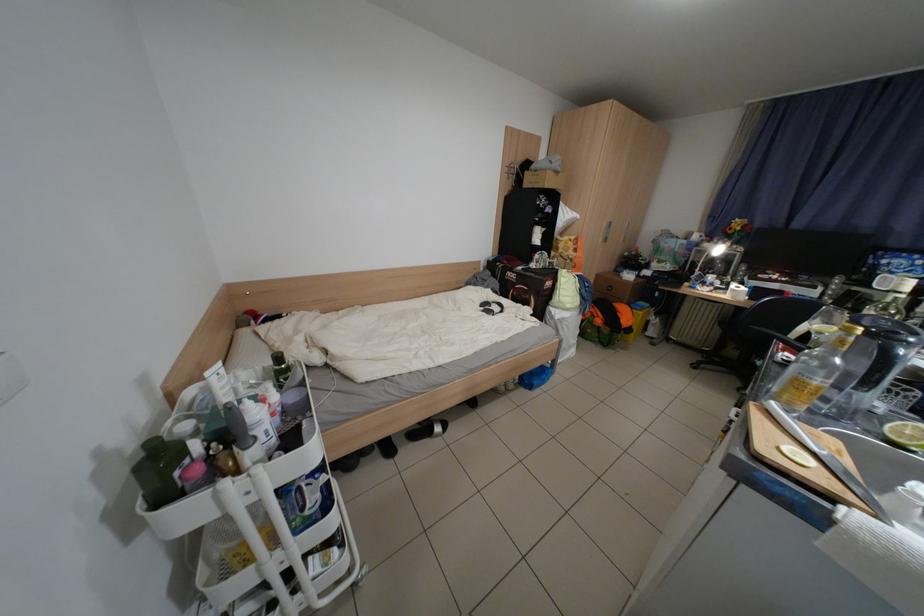
At what (x,y) coordinates should I click in order to perform the action: click on bottle with gold cap. Please return your answer as a coordinate pair (x, y). The image size is (924, 616). Looking at the image, I should click on (812, 371).